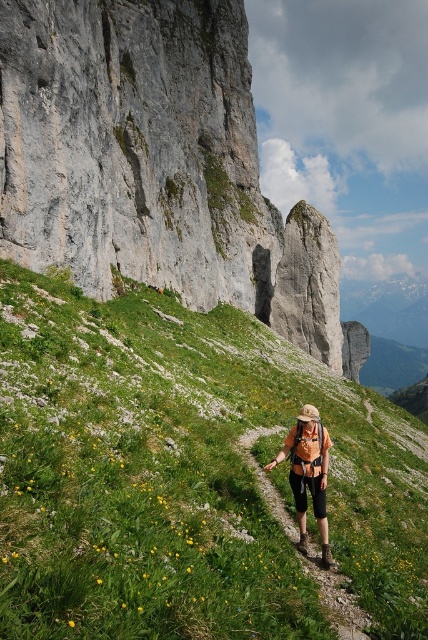
Question: Is gray rock formation at upper center below orange fabric backpack at center?

Choices:
 (A) no
 (B) yes

Answer: (A)

Question: Among these points, which one is farthest from the camera?

Choices:
 (A) (308, 563)
 (B) (323, 577)
 (C) (243, 100)
 (D) (297, 429)

Answer: (C)

Question: Does gray rock formation at upper center have a larger size compared to camouflage fabric backpack at center?

Choices:
 (A) no
 (B) yes

Answer: (B)

Question: Can you confirm if green grassy at center is positioned to the right of orange fabric backpack at center?

Choices:
 (A) yes
 (B) no

Answer: (B)

Question: Which of the following is the farthest from the observer?

Choices:
 (A) camouflage fabric backpack at center
 (B) orange fabric backpack at center
 (C) gray rock formation at upper center

Answer: (C)

Question: Which of these objects is positioned farthest from the green grassy at center?

Choices:
 (A) camouflage fabric backpack at center
 (B) gray rock formation at upper center
 (C) orange fabric backpack at center

Answer: (B)